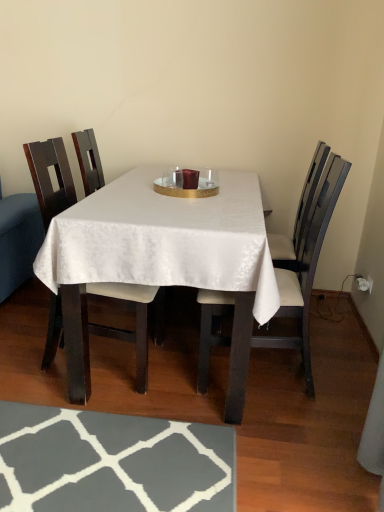
Question: From a real-world perspective, relative to wooden chair at center, which is the 2th chair in left-to-right order, is matte wood chair at left, which is the 2th chair from right to left, vertically above or below?

Choices:
 (A) below
 (B) above

Answer: (A)

Question: Looking at the image, does matte wood chair at left, which is the 2th chair from right to left, seem bigger or smaller compared to wooden chair at center, which ranks as the first chair in right-to-left order?

Choices:
 (A) small
 (B) big

Answer: (A)

Question: Which object is positioned farthest from the white satin table at center?

Choices:
 (A) matte wood chair at left, arranged as the 1th chair when viewed from the left
 (B) wooden chair at center, which ranks as the first chair in right-to-left order

Answer: (A)

Question: Based on their relative distances, which object is nearer to the wooden chair at center, which is the 2th chair in left-to-right order?

Choices:
 (A) matte wood chair at left, which is the 2th chair from right to left
 (B) white satin table at center

Answer: (B)